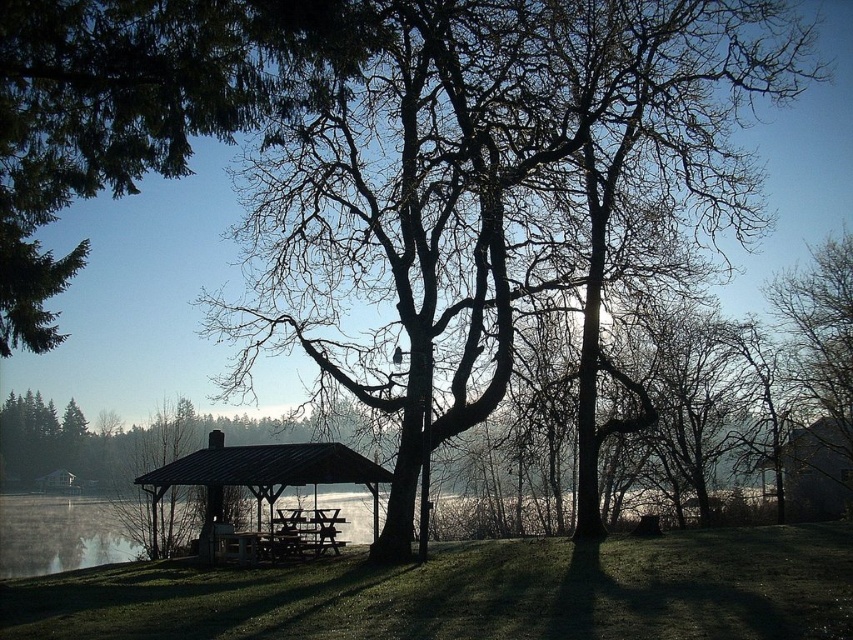
Question: Is the position of matte black gazebo at center more distant than that of wooden picnic table at center?

Choices:
 (A) yes
 (B) no

Answer: (B)

Question: Which object is farther from the camera taking this photo?

Choices:
 (A) wooden picnic table at center
 (B) clear water at center
 (C) green leafy tree at upper left
 (D) matte black gazebo at center

Answer: (B)

Question: Is the position of clear water at center more distant than that of matte black gazebo at center?

Choices:
 (A) no
 (B) yes

Answer: (B)

Question: Considering the real-world distances, which object is farthest from the green leafy tree at upper left?

Choices:
 (A) matte black gazebo at center
 (B) clear water at center

Answer: (B)

Question: Among these objects, which one is nearest to the camera?

Choices:
 (A) wooden picnic table at center
 (B) green leafy tree at upper left
 (C) clear water at center

Answer: (B)

Question: Does clear water at center appear under wooden picnic table at center?

Choices:
 (A) yes
 (B) no

Answer: (A)